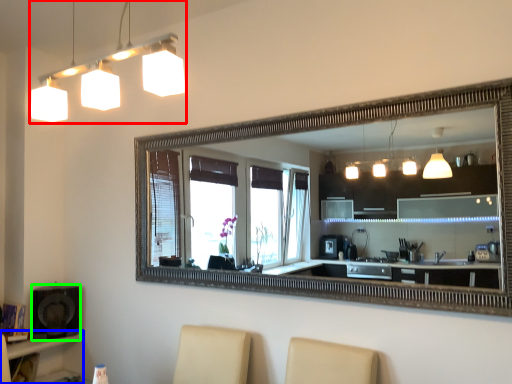
Question: Which object is positioned farthest from lamp (highlighted by a red box)? Select from vanity (highlighted by a blue box) and speaker (highlighted by a green box).

Choices:
 (A) vanity
 (B) speaker

Answer: (A)